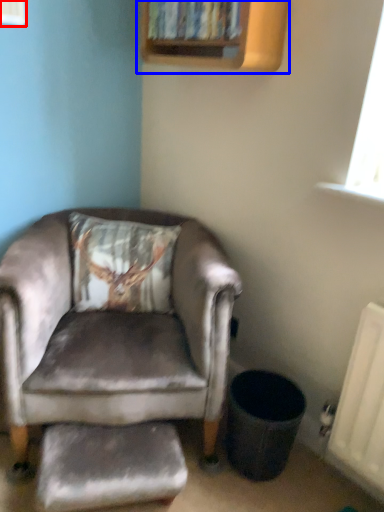
Question: Which object is further to the camera taking this photo, window (highlighted by a red box) or bookshelf (highlighted by a blue box)?

Choices:
 (A) window
 (B) bookshelf

Answer: (B)